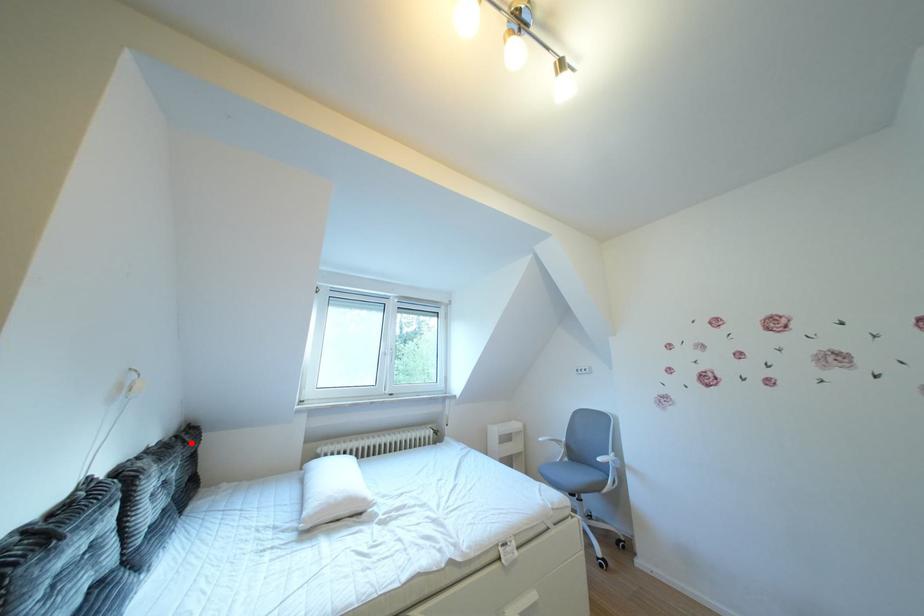
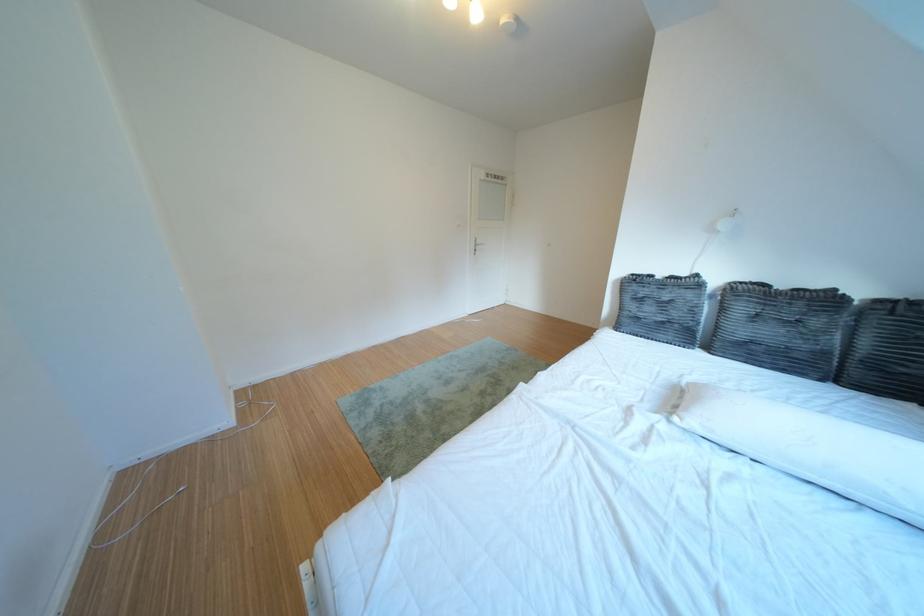
Question: I am providing you with two images of the same scene from different viewpoints. A red point is marked on the first image. At the location where the point appears in image 1, is it still visible in image 2?

Choices:
 (A) Yes
 (B) No

Answer: (A)